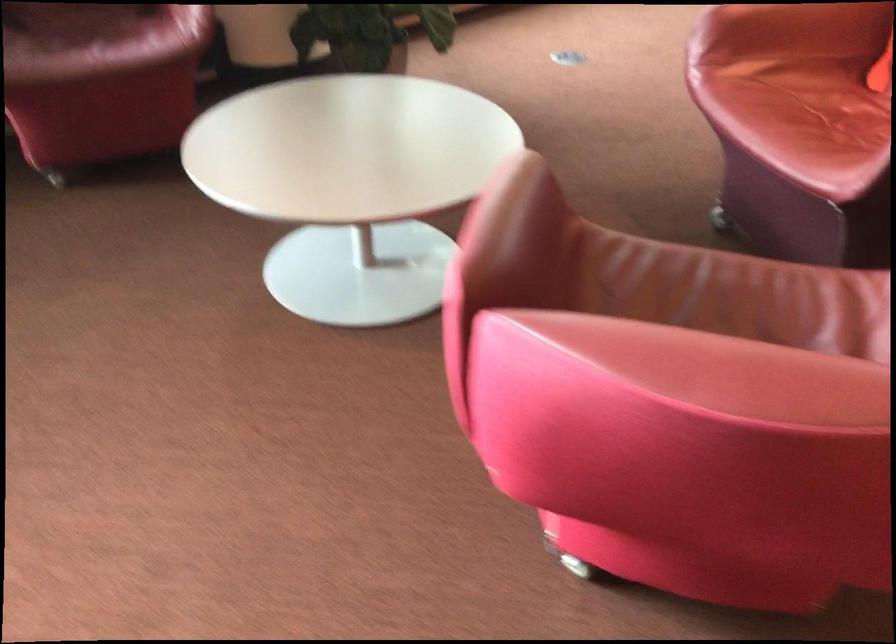
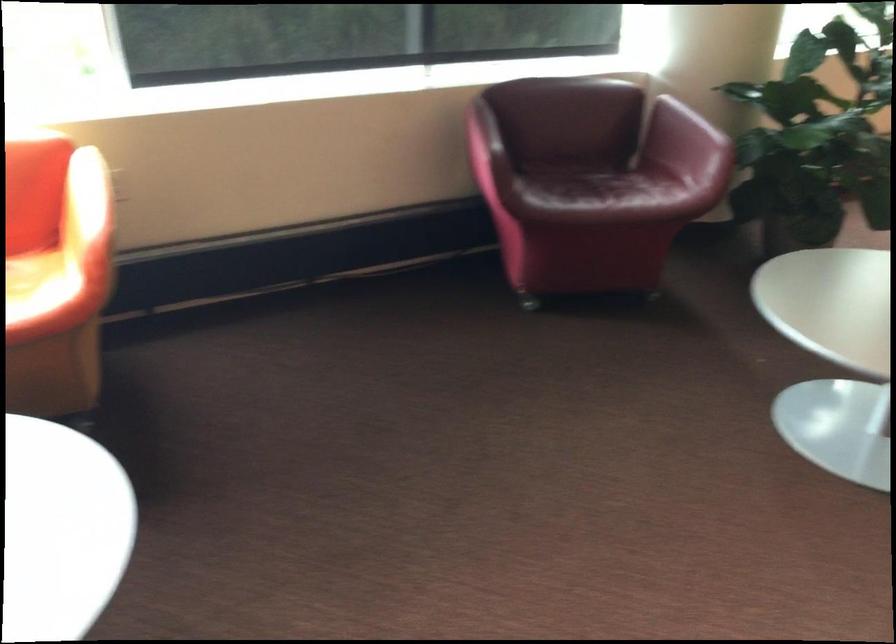
Question: What movement of the cameraman would produce the second image?

Choices:
 (A) Left
 (B) Right
 (C) Forward
 (D) Backward

Answer: (A)